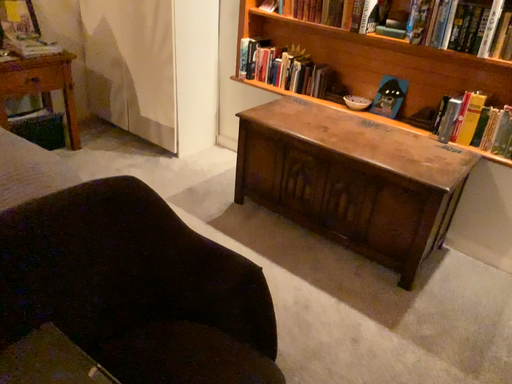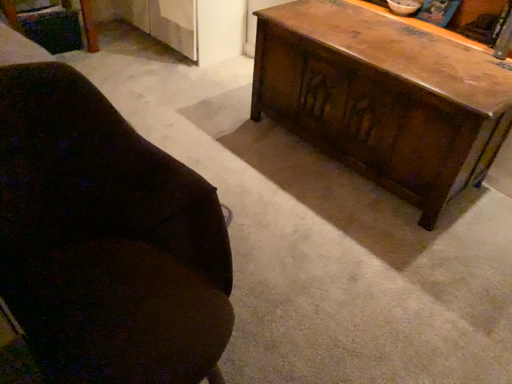
Question: How did the camera likely rotate when shooting the video?

Choices:
 (A) rotated left
 (B) rotated right

Answer: (A)